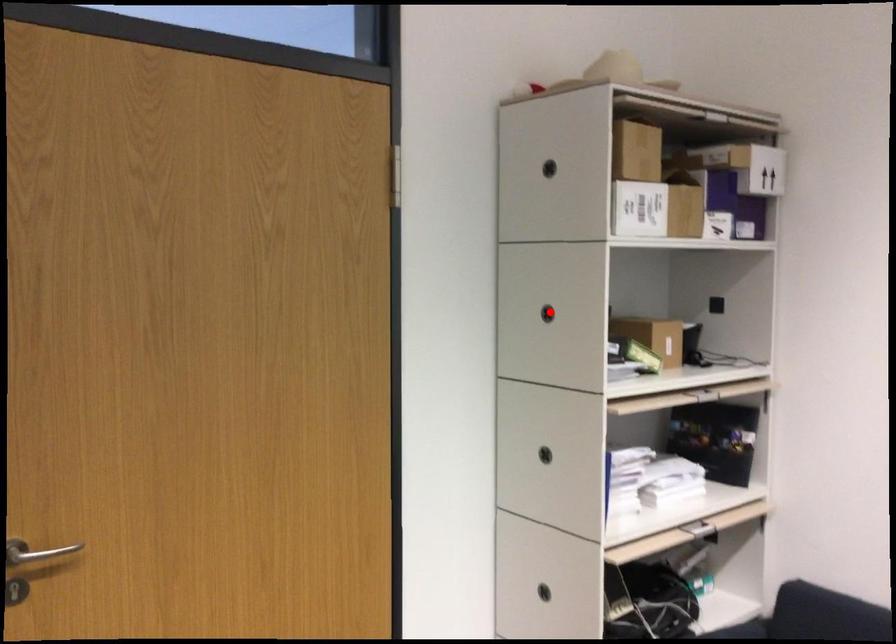
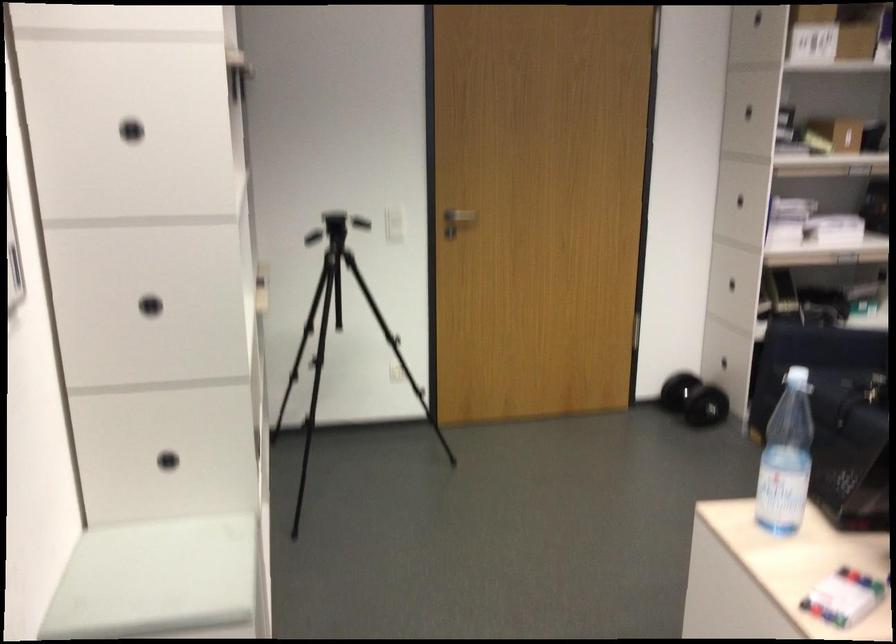
Where in the second image is the point corresponding to the highlighted location from the first image?

(747, 111)